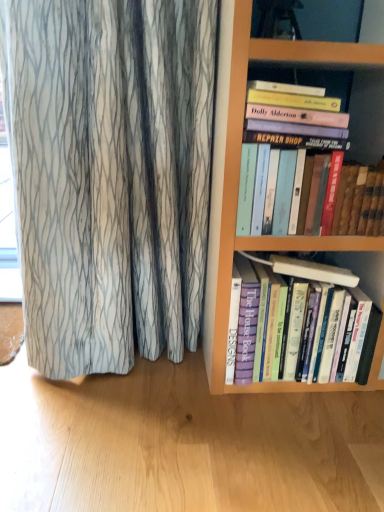
Question: Looking at the image, does hardcover books at upper right, marked as the 2th book in a bottom-to-top arrangement, seem bigger or smaller compared to purple hardcover book at center, the first book positioned from the bottom?

Choices:
 (A) small
 (B) big

Answer: (A)

Question: Is hardcover books at upper right, which is the first book in top-to-bottom order, in front of or behind purple hardcover book at center, the second book when ordered from top to bottom, in the image?

Choices:
 (A) behind
 (B) front

Answer: (B)

Question: Considering the positions of point (360, 222) and point (370, 356), is point (360, 222) closer or farther from the camera than point (370, 356)?

Choices:
 (A) farther
 (B) closer

Answer: (B)

Question: Would you say purple hardcover book at center, the second book when ordered from top to bottom, is inside or outside hardcover books at upper right, marked as the 2th book in a bottom-to-top arrangement?

Choices:
 (A) outside
 (B) inside

Answer: (A)

Question: Based on their positions, is purple hardcover book at center, the second book when ordered from top to bottom, located to the left or right of hardcover books at upper right, marked as the 2th book in a bottom-to-top arrangement?

Choices:
 (A) right
 (B) left

Answer: (B)

Question: From a real-world perspective, is purple hardcover book at center, the second book when ordered from top to bottom, positioned above or below hardcover books at upper right, which is the first book in top-to-bottom order?

Choices:
 (A) below
 (B) above

Answer: (A)

Question: Looking at the image, does purple hardcover book at center, the second book when ordered from top to bottom, seem bigger or smaller compared to hardcover books at upper right, marked as the 2th book in a bottom-to-top arrangement?

Choices:
 (A) small
 (B) big

Answer: (B)